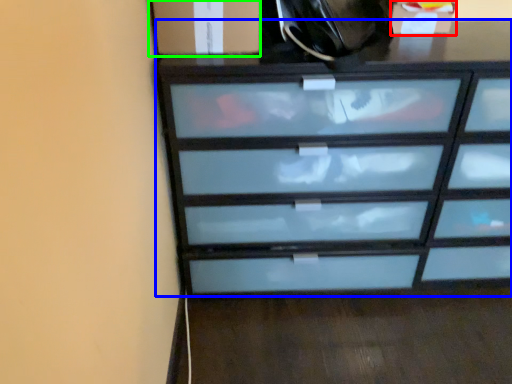
Question: Which is farther away from cabinetry (highlighted by a red box)? chest of drawers (highlighted by a blue box) or cabinetry (highlighted by a green box)?

Choices:
 (A) chest of drawers
 (B) cabinetry

Answer: (B)